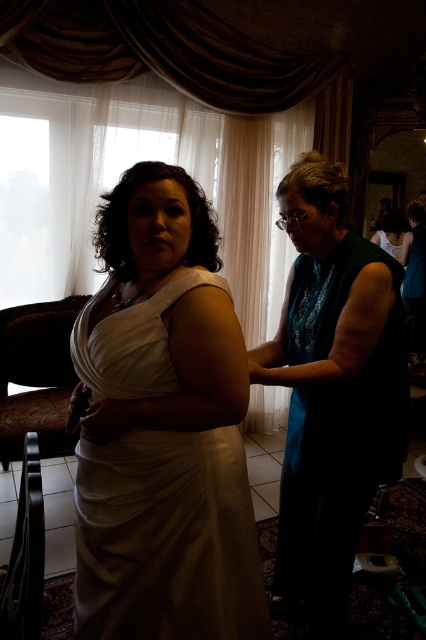
Question: Which is nearer to the teal sequined dress at right?

Choices:
 (A) white satin dress at center
 (B) matte black dress at center

Answer: (A)

Question: Does teal sequined dress at right appear under matte black dress at center?

Choices:
 (A) yes
 (B) no

Answer: (A)

Question: Which object appears farthest from the camera in this image?

Choices:
 (A) teal sequined dress at right
 (B) white satin dress at center

Answer: (A)

Question: Does white satin dress at center appear over matte black dress at center?

Choices:
 (A) no
 (B) yes

Answer: (A)

Question: Which object appears closest to the camera in this image?

Choices:
 (A) white satin dress at center
 (B) matte black dress at center

Answer: (A)

Question: Does white sheer curtain at upper center come in front of matte black dress at center?

Choices:
 (A) no
 (B) yes

Answer: (B)